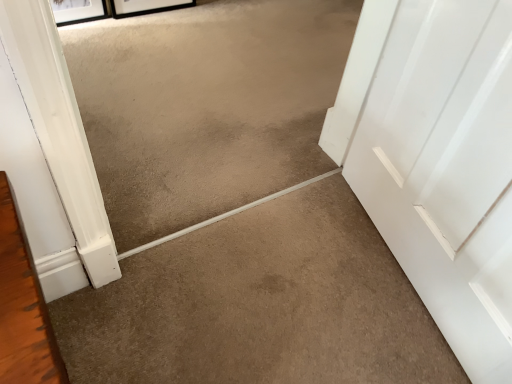
This screenshot has height=384, width=512. Identify the location of brown carpet at center. (260, 305).

Measure the distance between point (342, 362) and camera.

Point (342, 362) and camera are 1.04 meters apart from each other.

Image resolution: width=512 pixels, height=384 pixels. What do you see at coordinates (260, 305) in the screenshot?
I see `brown carpet at center` at bounding box center [260, 305].

You are a GUI agent. You are given a task and a screenshot of the screen. Output one action in this format:
    pyautogui.click(x=<x>, y=<y>)
    Task: Click on the brown carpet at center
    
    Given the screenshot: What is the action you would take?
    pyautogui.click(x=260, y=305)